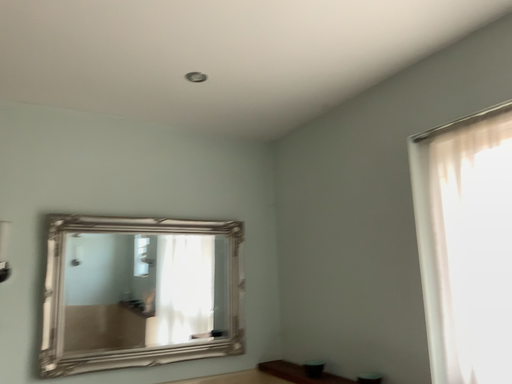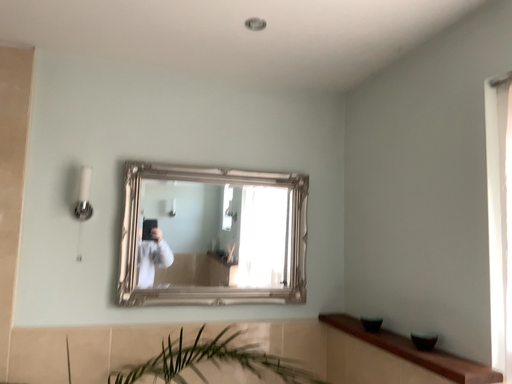
Question: Which way did the camera rotate in the video?

Choices:
 (A) rotated left
 (B) rotated right

Answer: (A)